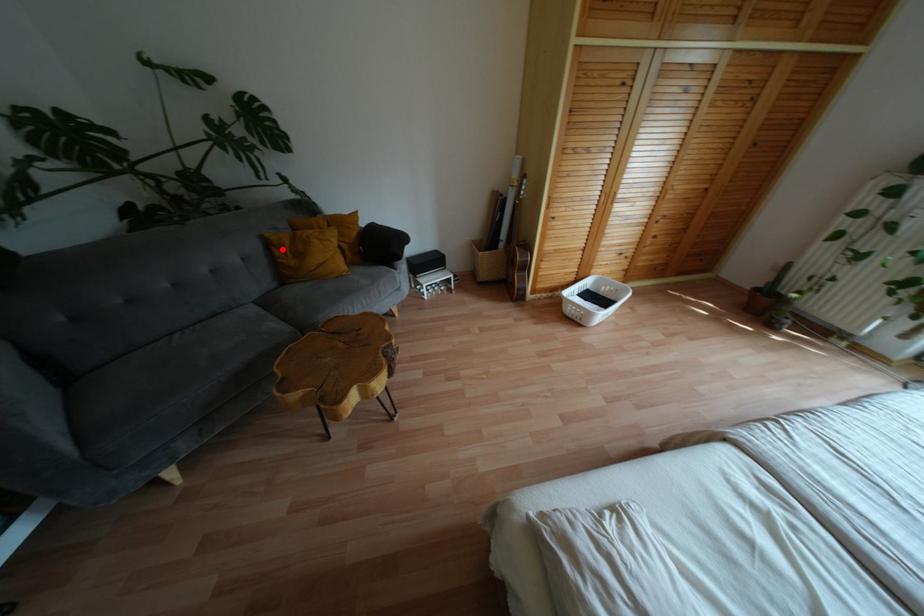
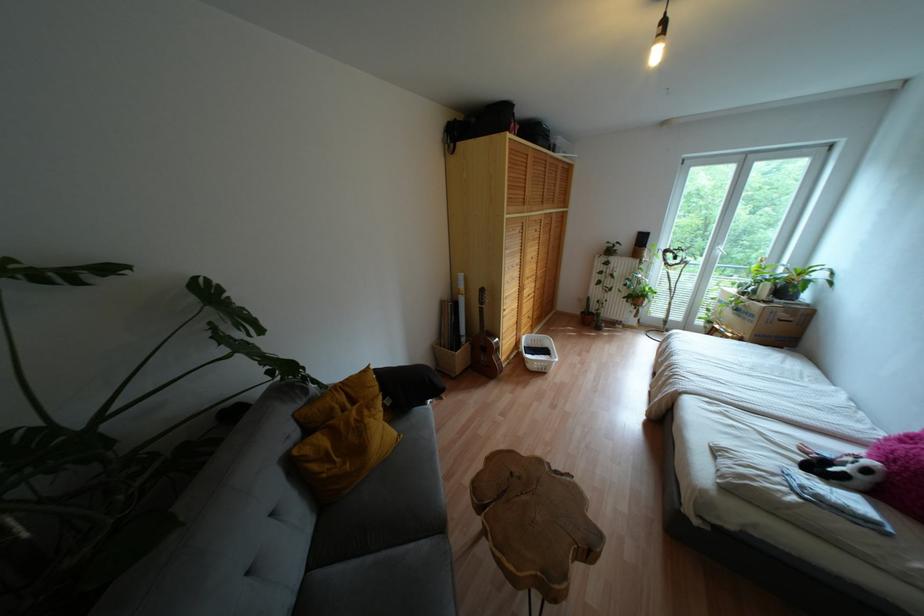
Question: I am providing you with two images of the same scene from different viewpoints. A red point is shown in image1. For the corresponding object point in image2, is it positioned nearer or farther from the camera?

Choices:
 (A) Nearer
 (B) Farther

Answer: (B)